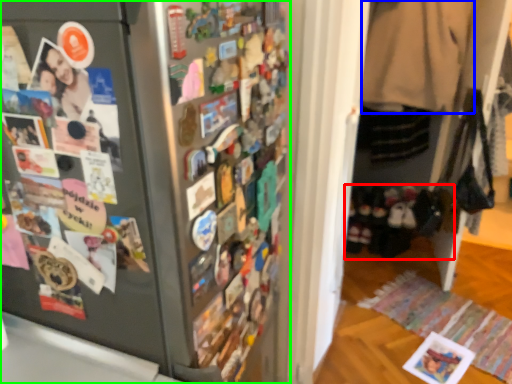
Question: Which object is the farthest from footwear (highlighted by a red box)? Choose among these: clothing (highlighted by a blue box) or refrigerator (highlighted by a green box).

Choices:
 (A) clothing
 (B) refrigerator

Answer: (B)